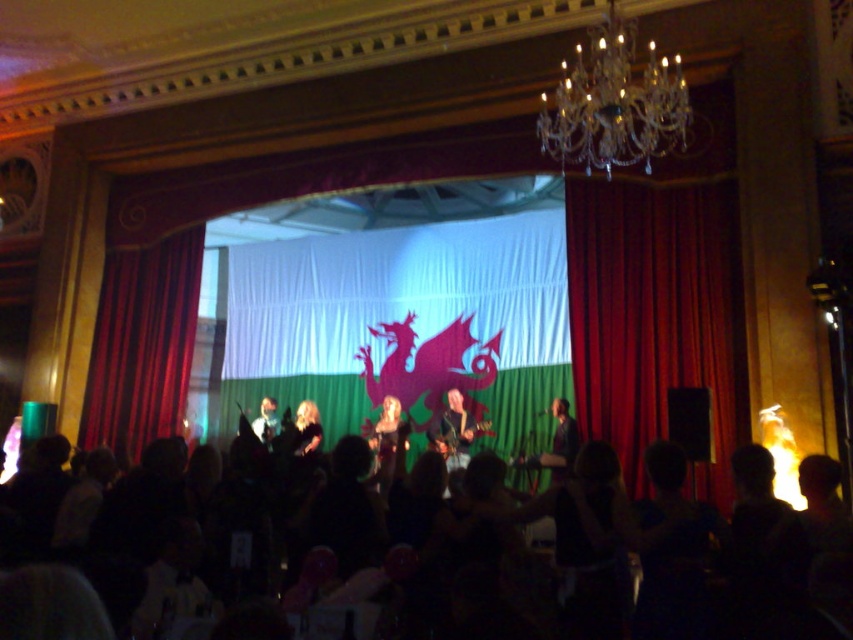
Does silhouette crowd at center come in front of red velvet curtain at left?

That is True.

Can you confirm if silhouette crowd at center is thinner than red velvet curtain at left?

No, silhouette crowd at center is not thinner than red velvet curtain at left.

What do you see at coordinates (796, 563) in the screenshot? This screenshot has width=853, height=640. I see `silhouette crowd at center` at bounding box center [796, 563].

This screenshot has height=640, width=853. I want to click on silhouette crowd at center, so click(x=796, y=563).

Based on the photo, does red velvet curtain at right appear over matte black dress at center?

Yes.

Does red velvet curtain at right appear on the left side of matte black dress at center?

No, red velvet curtain at right is not to the left of matte black dress at center.

Which is in front, point (611, 268) or point (383, 420)?

Positioned in front is point (611, 268).

Where is `red velvet curtain at right`? red velvet curtain at right is located at coordinates click(x=654, y=316).

Does red velvet curtain at left have a greater height compared to dark brown leather jacket at center?

Correct, red velvet curtain at left is much taller as dark brown leather jacket at center.

Does red velvet curtain at left have a lesser width compared to dark brown leather jacket at center?

No.

Is point (172, 342) closer to viewer compared to point (566, 458)?

No, (172, 342) is further to viewer.

Locate an element on the screen. Image resolution: width=853 pixels, height=640 pixels. red velvet curtain at left is located at coordinates (142, 344).